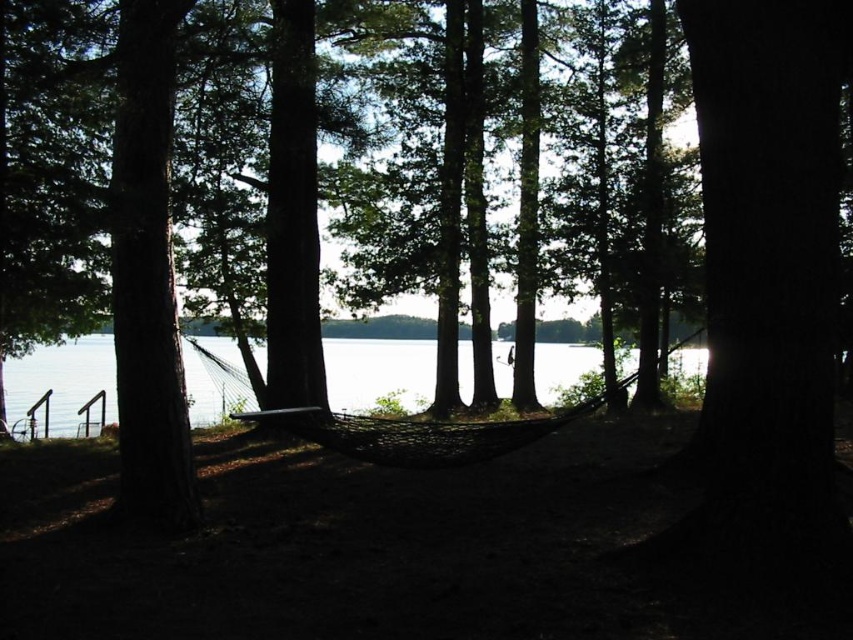
You are standing in the lakeside area and want to take a photo of the black mesh hammock at center and the clear water at center. Which object should you position to the right side of your camera frame to ensure both are visible?

You should position the black mesh hammock at center to the right side of your camera frame because the clear water at center is located to the left of the black mesh hammock at center.

Looking at this image, you are planning to take a photo of the clear water at center and the black mesh hammock at center from the lakeside. Which object should you focus on first to ensure both are in the frame?

The black mesh hammock at center is behind the clear water at center, so you should focus on the clear water at center first to ensure both are in the frame.

You are planning to take a nap in the black mesh hammock at center. Considering the clear water at center is higher than the hammock, what might you need to be cautious about?

The clear water at center is higher than the black mesh hammock at center, so you should be cautious of potential flooding or water reaching the hammock if the water level rises.